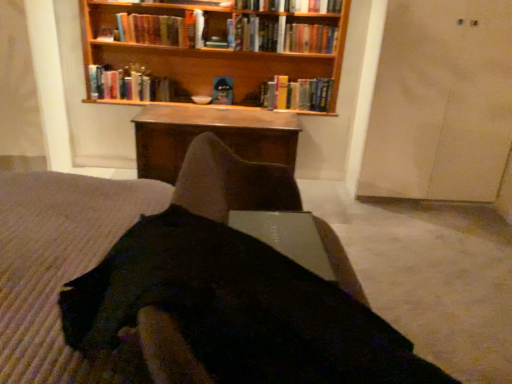
What do you see at coordinates (280, 36) in the screenshot? Image resolution: width=512 pixels, height=384 pixels. I see `hardcover book at upper center, placed as the 5th book when sorted from left to right` at bounding box center [280, 36].

The height and width of the screenshot is (384, 512). I want to click on metallic silver laptop at center, so click(x=288, y=237).

The width and height of the screenshot is (512, 384). What do you see at coordinates (152, 29) in the screenshot?
I see `hardcover book at upper center, the 2th book when ordered from left to right` at bounding box center [152, 29].

The image size is (512, 384). What do you see at coordinates (129, 84) in the screenshot?
I see `hardcover book at center, marked as the sixth book in a right-to-left arrangement` at bounding box center [129, 84].

This screenshot has width=512, height=384. Find the location of `hardcover book at center, marked as the sixth book in a right-to-left arrangement`. hardcover book at center, marked as the sixth book in a right-to-left arrangement is located at coordinates (129, 84).

Locate an element on the screen. The width and height of the screenshot is (512, 384). hardcover book at center, the first book positioned from the right is located at coordinates coord(298,94).

From a real-world perspective, is hardcover book at upper center, which is the 3th book in right-to-left order, located higher than hardcover book at center, marked as the sixth book in a right-to-left arrangement?

Yes, from a real-world perspective, hardcover book at upper center, which is the 3th book in right-to-left order, is over hardcover book at center, marked as the sixth book in a right-to-left arrangement

Locate an element on the screen. the 4th book located beneath the hardcover book at upper center, which is the 4th book from left to right (from a real-world perspective) is located at coordinates (129, 84).

Is hardcover book at upper center, which is the 3th book in right-to-left order, bigger than hardcover book at center, marked as the sixth book in a right-to-left arrangement?

No.

Which of these two, hardcover book at upper center, the 2th book when ordered from left to right, or wooden bookshelf at upper center, is thinner?

hardcover book at upper center, the 2th book when ordered from left to right, is thinner.

Is hardcover book at upper center, marked as the 5th book in a right-to-left arrangement, not within wooden bookshelf at upper center?

No, hardcover book at upper center, marked as the 5th book in a right-to-left arrangement, is not outside of wooden bookshelf at upper center.

Considering the positions of objects hardcover book at upper center, marked as the 5th book in a right-to-left arrangement, and wooden bookshelf at upper center in the image provided, who is more to the left, hardcover book at upper center, marked as the 5th book in a right-to-left arrangement, or wooden bookshelf at upper center?

hardcover book at upper center, marked as the 5th book in a right-to-left arrangement.

How different are the orientations of hardcover book at upper center, placed as the 5th book when sorted from left to right, and black fabric dress at center in degrees?

The angular difference between hardcover book at upper center, placed as the 5th book when sorted from left to right, and black fabric dress at center is 92.7 degrees.

Which object is wider, hardcover book at upper center, the 2th book from the right, or black fabric dress at center?

With larger width is black fabric dress at center.

Considering the points (306, 31) and (219, 266), which point is behind, point (306, 31) or point (219, 266)?

The point (306, 31) is behind.

Is hardcover book at upper center, the 2th book from the right, looking in the opposite direction of black fabric dress at center?

No, hardcover book at upper center, the 2th book from the right,'s orientation is not away from black fabric dress at center.

From a real-world perspective, who is located lower, hardcover book at upper center, the 2th book when ordered from left to right, or hardcover book at center, the 6th book positioned from the left?

In real-world perspective, hardcover book at center, the 6th book positioned from the left, is lower.

Based on the photo, is hardcover book at upper center, the 2th book when ordered from left to right, looking in the opposite direction of hardcover book at center, the 6th book positioned from the left?

No, hardcover book at upper center, the 2th book when ordered from left to right, is not facing away from hardcover book at center, the 6th book positioned from the left.

Is hardcover book at upper center, marked as the 5th book in a right-to-left arrangement, inside or outside of hardcover book at center, the 6th book positioned from the left?

The correct answer is: outside.

The image size is (512, 384). In order to click on table in front of the hardcover book at center, the first book positioned from the right in this screenshot , I will do `click(213, 133)`.

Is wooden table at center to the left or to the right of hardcover book at center, the first book positioned from the right, in the image?

From the image, it's evident that wooden table at center is to the left of hardcover book at center, the first book positioned from the right.

Considering the points (135, 126) and (322, 81), which point is in front, point (135, 126) or point (322, 81)?

The point (135, 126) is closer to the camera.

Is wooden table at center not near hardcover book at center, the 6th book positioned from the left?

No, there isn't a large distance between wooden table at center and hardcover book at center, the 6th book positioned from the left.

From the image's perspective, count 1st books upward from the wooden bookshelf at upper center and point to it. Please provide its 2D coordinates.

[(280, 36)]

Considering their positions, is wooden bookshelf at upper center located in front of or behind hardcover book at upper center, the 2th book from the right?

Visually, wooden bookshelf at upper center is located in front of hardcover book at upper center, the 2th book from the right.

Consider the image. Between wooden bookshelf at upper center and hardcover book at upper center, placed as the 5th book when sorted from left to right, which one has larger width?

wooden bookshelf at upper center is wider.

Relative to hardcover book at center, marked as the sixth book in a right-to-left arrangement, is hardcover book at center, the 4th book when ordered from right to left, in front or behind?

In the image, hardcover book at center, the 4th book when ordered from right to left, appears behind hardcover book at center, marked as the sixth book in a right-to-left arrangement.

Can you see hardcover book at center, the 4th book when ordered from right to left, touching hardcover book at center, marked as the sixth book in a right-to-left arrangement?

No, hardcover book at center, the 4th book when ordered from right to left, is not in contact with hardcover book at center, marked as the sixth book in a right-to-left arrangement.

This screenshot has width=512, height=384. Identify the location of book that is the 2nd object located behind the hardcover book at center, marked as the sixth book in a right-to-left arrangement. (222, 90).

Is hardcover book at center, the 4th book when ordered from right to left, looking in the opposite direction of hardcover book at center, marked as the sixth book in a right-to-left arrangement?

hardcover book at center, the 4th book when ordered from right to left, is not turned away from hardcover book at center, marked as the sixth book in a right-to-left arrangement.

Identify the location of book that is the 4th one below the hardcover book at upper center, which is the 4th book from left to right (from a real-world perspective). (129, 84).

Locate an element on the screen. the 2nd book behind the wooden bookshelf at upper center, counting from the anchor's position is located at coordinates (152, 29).

Based on their spatial positions, is hardcover book at upper center, marked as the 5th book in a right-to-left arrangement, or wooden bookshelf at upper center closer to metallic silver laptop at center?

The object closer to metallic silver laptop at center is wooden bookshelf at upper center.

Looking at the image, which one is located closer to hardcover book at center, the 6th book positioned from the left, black fabric dress at center or wooden bookshelf at upper center?

wooden bookshelf at upper center lies closer to hardcover book at center, the 6th book positioned from the left, than the other object.

Which object lies further to the anchor point hardcover book at center, the first book positioned from the right, hardcover book at upper center, the 2th book from the right, or metallic silver laptop at center?

metallic silver laptop at center is further to hardcover book at center, the first book positioned from the right.

Estimate the real-world distances between objects in this image. Which object is closer to hardcover book at upper center, the 2th book when ordered from left to right, hardcover book at upper center, which is the 3th book in right-to-left order, or hardcover book at center, the first book positioned from the right?

hardcover book at upper center, which is the 3th book in right-to-left order.

Estimate the real-world distances between objects in this image. Which object is closer to metallic silver laptop at center, wooden table at center or hardcover book at upper center, the 2th book when ordered from left to right?

Based on the image, wooden table at center appears to be nearer to metallic silver laptop at center.

Considering their positions, is hardcover book at upper center, the 2th book from the right, positioned further to hardcover book at center, marked as the sixth book in a right-to-left arrangement, than hardcover book at upper center, marked as the 5th book in a right-to-left arrangement?

hardcover book at upper center, the 2th book from the right, is positioned further to the anchor hardcover book at center, marked as the sixth book in a right-to-left arrangement.

Estimate the real-world distances between objects in this image. Which object is further from black fabric dress at center, wooden table at center or metallic silver laptop at center?

wooden table at center is further to black fabric dress at center.

When comparing their distances from hardcover book at center, the 6th book positioned from the left, does hardcover book at center, marked as the first book in a left-to-right arrangement, or wooden bookshelf at upper center seem further?

hardcover book at center, marked as the first book in a left-to-right arrangement, is further to hardcover book at center, the 6th book positioned from the left.

Identify the location of book located between hardcover book at center, marked as the first book in a left-to-right arrangement, and hardcover book at center, the 4th book when ordered from right to left, in the left-right direction. This screenshot has height=384, width=512. (152, 29).

You are a GUI agent. You are given a task and a screenshot of the screen. Output one action in this format:
    pyautogui.click(x=<x>, y=<y>)
    Task: Click on the table positioned between black fabric dress at center and hardcover book at center, the 4th book when ordered from right to left, from near to far
    
    Given the screenshot: What is the action you would take?
    pyautogui.click(x=213, y=133)

Find the location of a particular element. bookcase between metallic silver laptop at center and hardcover book at upper center, marked as the 5th book in a right-to-left arrangement, in the front-back direction is located at coordinates (214, 52).

This screenshot has height=384, width=512. Find the location of `bookcase between black fabric dress at center and hardcover book at upper center, the 2th book when ordered from left to right, in the front-back direction`. bookcase between black fabric dress at center and hardcover book at upper center, the 2th book when ordered from left to right, in the front-back direction is located at coordinates (214, 52).